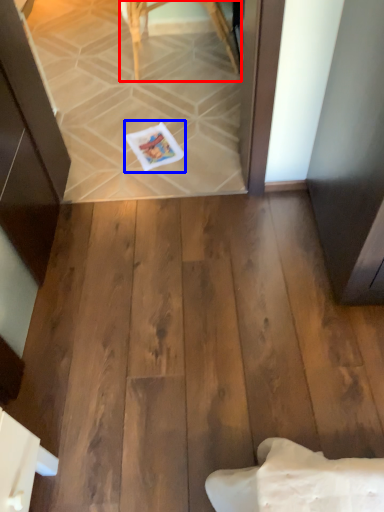
Question: Which of the following is the closest to the observer, furniture (highlighted by a red box) or postcard (highlighted by a blue box)?

Choices:
 (A) furniture
 (B) postcard

Answer: (B)